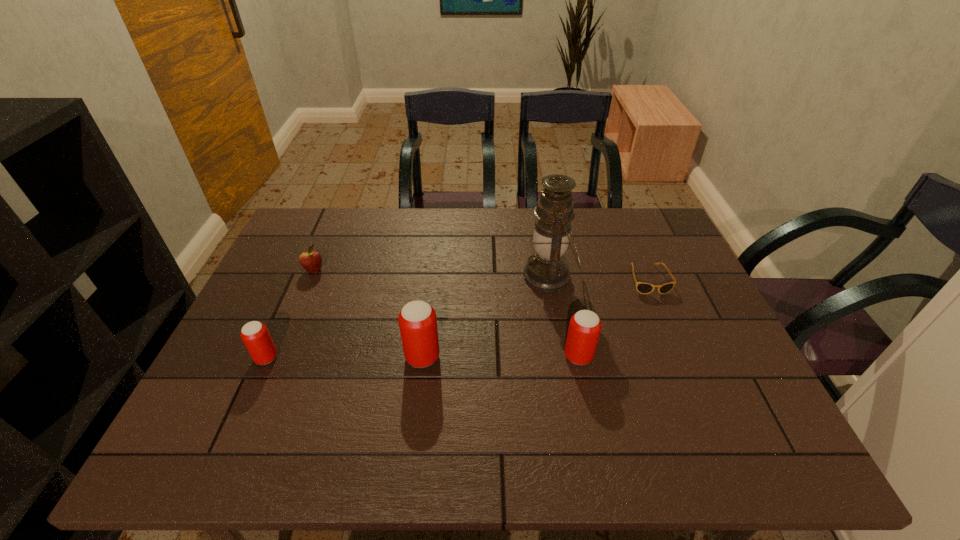
Given the evenly spaced beer cans in the image, where should an extra beer can be added on the right to preserve the spacing? Please point to a vacant space. Please provide its 2D coordinates. Your answer should be formatted as a tuple, i.e. [(x, y)], where the tuple contains the x and y coordinates of a point satisfying the conditions above.

[(733, 355)]